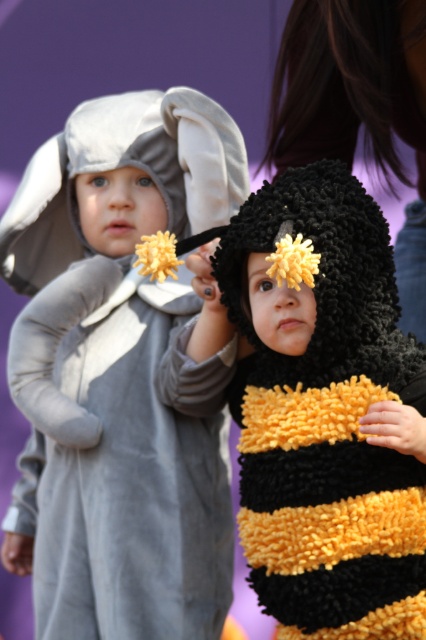
Who is taller, fuzzy yellow-black bee at center or black fuzzy hat at upper center?

fuzzy yellow-black bee at center

What do you see at coordinates (324, 413) in the screenshot?
I see `fuzzy yellow-black bee at center` at bounding box center [324, 413].

Which is in front, point (393, 364) or point (420, 42)?

Positioned in front is point (393, 364).

Image resolution: width=426 pixels, height=640 pixels. I want to click on fuzzy yellow-black bee at center, so click(324, 413).

The width and height of the screenshot is (426, 640). What do you see at coordinates (120, 374) in the screenshot? I see `velvety gray elephant at left` at bounding box center [120, 374].

Is point (210, 100) closer to viewer compared to point (298, 502)?

No, it is not.

Is point (146, 321) less distant than point (359, 304)?

No, it is behind (359, 304).

What are the coordinates of `velvety gray elephant at left` in the screenshot? It's located at (120, 374).

From the picture: Is velvety gray elephant at left below black fuzzy hat at upper center?

Indeed, velvety gray elephant at left is positioned under black fuzzy hat at upper center.

Measure the distance between point (71,406) and camera.

The distance of point (71,406) from camera is 8.89 feet.

I want to click on velvety gray elephant at left, so click(x=120, y=374).